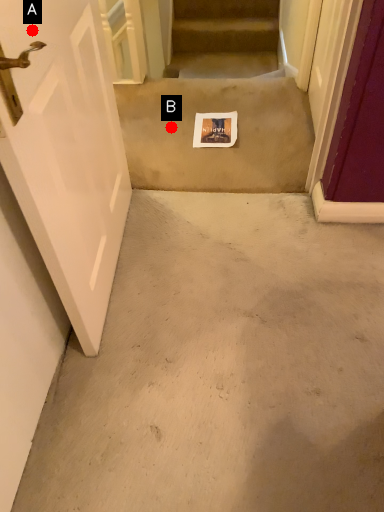
Question: Two points are circled on the image, labeled by A and B beside each circle. Which of the following is the farthest from the observer?

Choices:
 (A) A is further
 (B) B is further

Answer: (B)